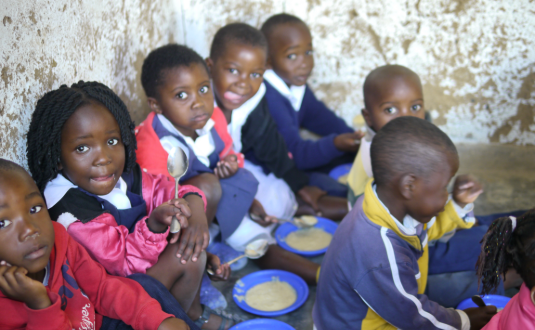
At what (x,y) coordinates should I click in order to perform the action: click on floor. Please return your answer as a coordinate pair (x, y). The height and width of the screenshot is (330, 535). Looking at the image, I should click on [x=503, y=170].